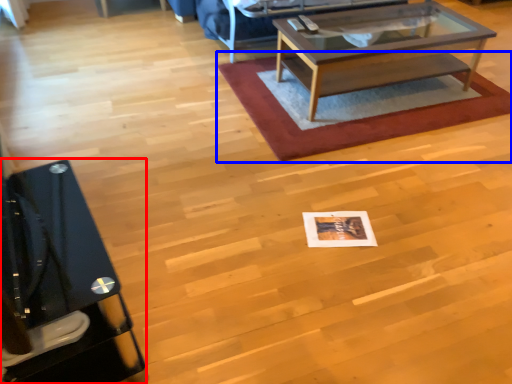
Question: Which of the following is the closest to the observer, desk (highlighted by a red box) or mat (highlighted by a blue box)?

Choices:
 (A) desk
 (B) mat

Answer: (A)